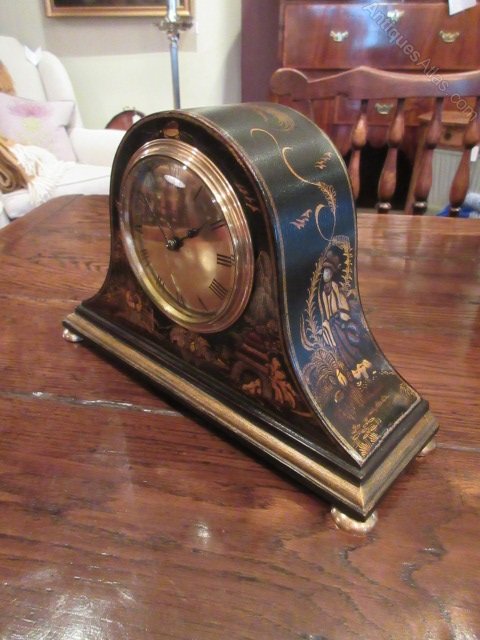
Point out all instances of where you'd open the drawer in the image. Your answer should be formatted as a list of tuples, i.e. [(x1, y1), (x2, y2), ...], where each tuple contains the x and y coordinates of a point satisfying the conditions above.

[(343, 36), (384, 105), (450, 36)]